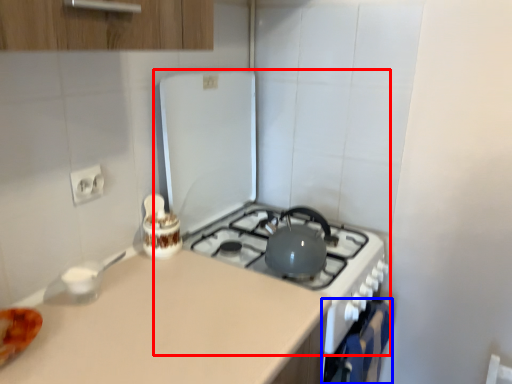
Question: Which object appears farthest to the camera in this image, appliance (highlighted by a red box) or oven (highlighted by a blue box)?

Choices:
 (A) appliance
 (B) oven

Answer: (B)